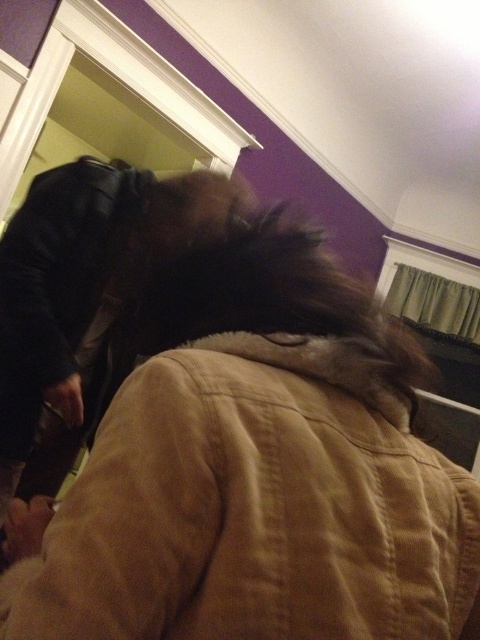
Question: Can you confirm if brown fur coat at upper center is positioned below leather jacket at left?

Choices:
 (A) yes
 (B) no

Answer: (A)

Question: Is brown fur coat at upper center closer to camera compared to leather jacket at left?

Choices:
 (A) no
 (B) yes

Answer: (B)

Question: Which point is farther to the camera?

Choices:
 (A) (99, 461)
 (B) (17, 289)

Answer: (B)

Question: Does brown fur coat at upper center appear on the left side of leather jacket at left?

Choices:
 (A) yes
 (B) no

Answer: (B)